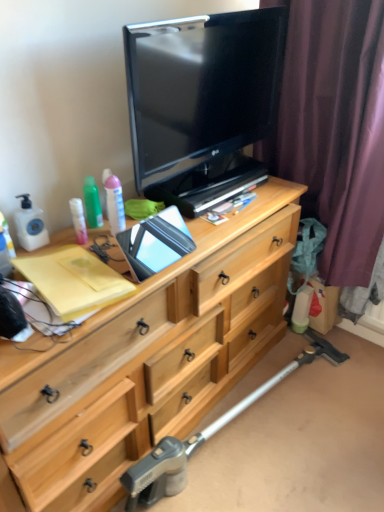
Find the location of a particular element. Image resolution: width=384 pixels, height=512 pixels. vacant space underneath metallic silver crutch at lower center (from a real-world perspective) is located at coordinates (253, 422).